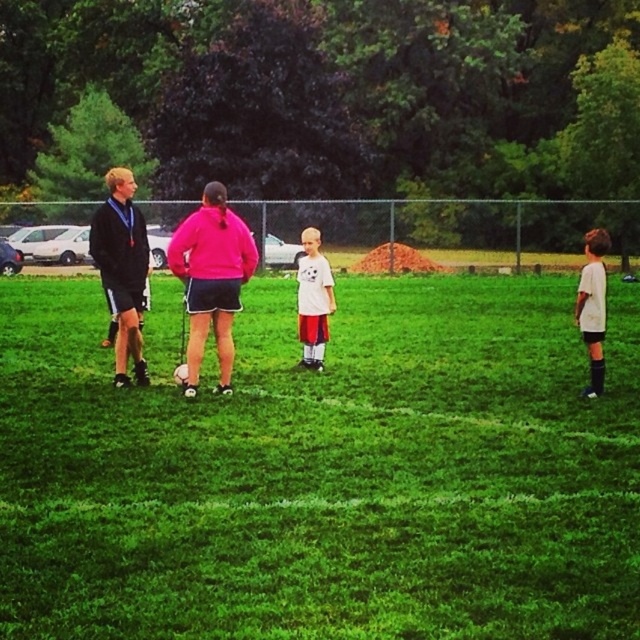
Question: Which point appears closest to the camera in this image?

Choices:
 (A) (124, 180)
 (B) (496, 412)

Answer: (B)

Question: Can you confirm if matte black jacket at left is bigger than white matte shirt at center?

Choices:
 (A) yes
 (B) no

Answer: (A)

Question: Is white matte shirt at center smaller than white matte shirt at right?

Choices:
 (A) no
 (B) yes

Answer: (B)

Question: Which point appears farthest from the camera in this image?

Choices:
 (A) (604, 240)
 (B) (145, 304)
 (C) (230, 476)
 (D) (225, 204)

Answer: (B)

Question: Does matte black jacket at left have a smaller size compared to white matte shirt at center?

Choices:
 (A) no
 (B) yes

Answer: (A)

Question: Which point is farther from the camera taking this photo?

Choices:
 (A) [x=204, y=214]
 (B) [x=397, y=476]

Answer: (A)